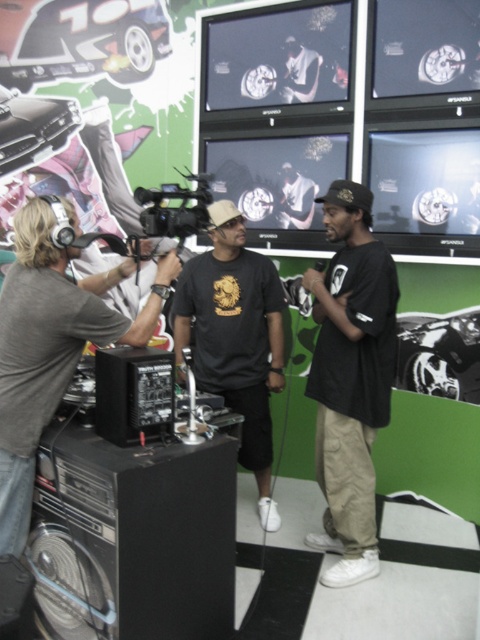
Can you confirm if black cotton shirt at center is wider than black plastic video camera at center?

Indeed, black cotton shirt at center has a greater width compared to black plastic video camera at center.

Is point (333, 259) in front of point (204, 195)?

Yes, it is in front of point (204, 195).

Which is in front, point (394, 346) or point (142, 192)?

Point (142, 192) is more forward.

Where is `black cotton shirt at center`? The width and height of the screenshot is (480, 640). black cotton shirt at center is located at coordinates (350, 378).

Does black cotton shirt at center appear under gray fabric headphones at left?

Indeed, black cotton shirt at center is positioned under gray fabric headphones at left.

Does point (372, 300) lie in front of point (128, 340)?

That is False.

This screenshot has width=480, height=640. I want to click on black cotton shirt at center, so click(x=350, y=378).

Between gray fabric headphones at left and black matte t-shirt at center, which one has less height?

Result: Standing shorter between the two is gray fabric headphones at left.

Is gray fabric headphones at left to the right of black matte t-shirt at center from the viewer's perspective?

Incorrect, gray fabric headphones at left is not on the right side of black matte t-shirt at center.

Who is more distant from viewer, (x=31, y=209) or (x=175, y=348)?

Point (x=175, y=348)

Where is `gray fabric headphones at left`? This screenshot has width=480, height=640. gray fabric headphones at left is located at coordinates (50, 348).